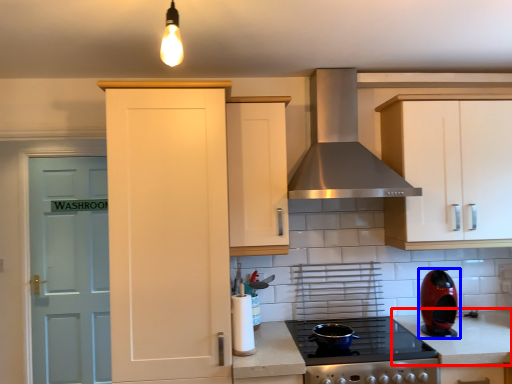
Question: Which object is further to the camera taking this photo, counter top (highlighted by a red box) or kitchen appliance (highlighted by a blue box)?

Choices:
 (A) counter top
 (B) kitchen appliance

Answer: (B)